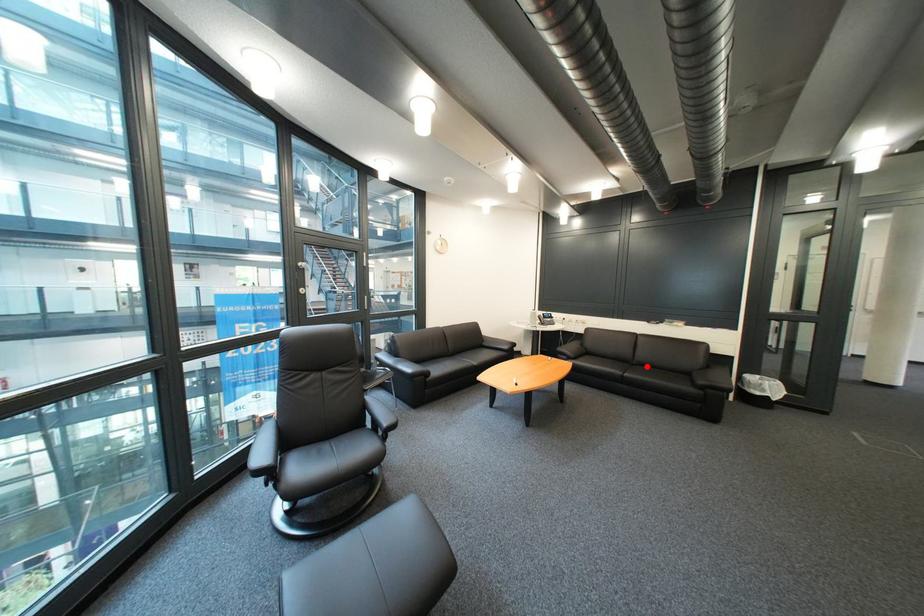
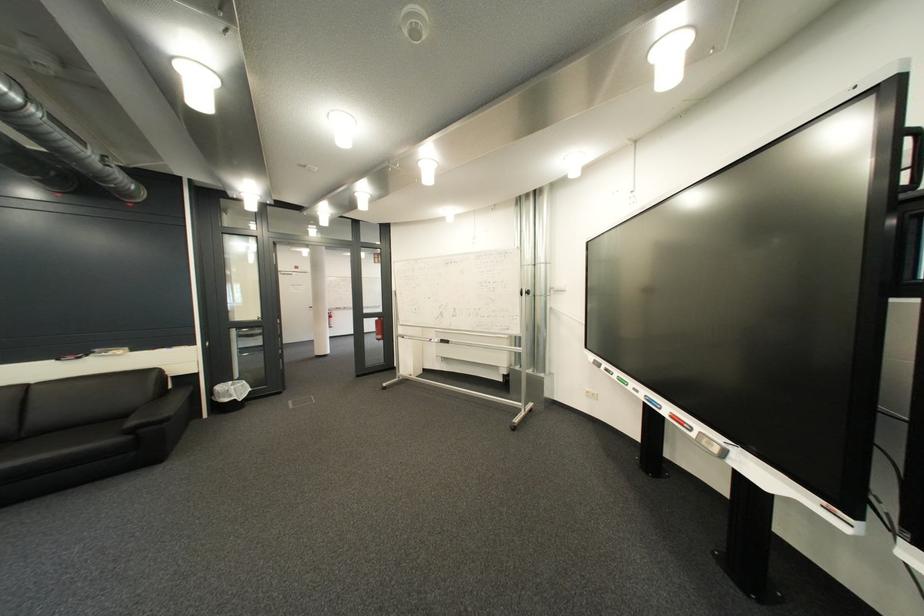
Question: I am providing you with two images of the same scene from different viewpoints. Given a red point in image1, look at the same physical point in image2. Is it:

Choices:
 (A) Closer to the viewpoint
 (B) Farther from the viewpoint

Answer: (A)